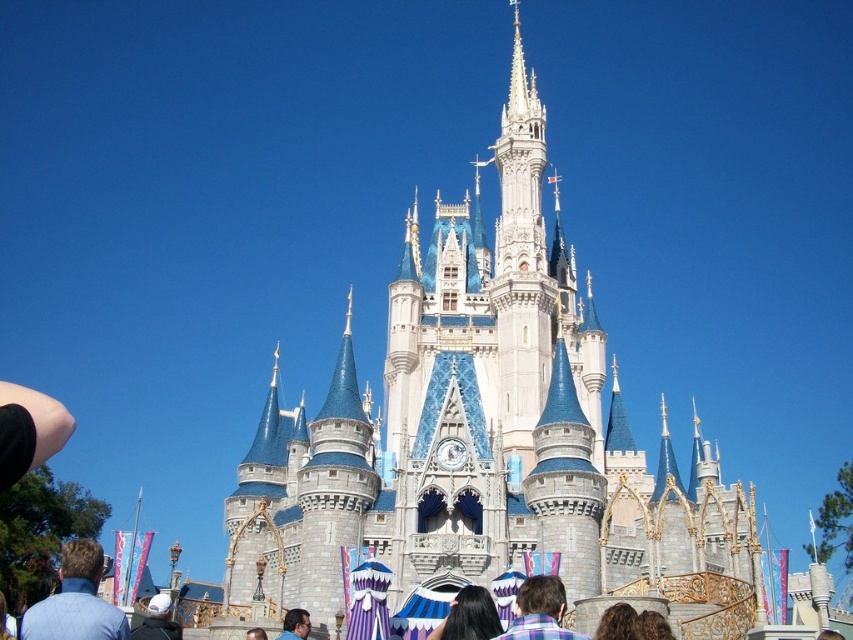
Which of these two, blue shirt at lower left or white matte helmet at lower left, stands taller?

blue shirt at lower left

Can you confirm if blue shirt at lower left is bigger than white matte helmet at lower left?

Yes, blue shirt at lower left is bigger than white matte helmet at lower left.

What do you see at coordinates (74, 600) in the screenshot? I see `blue shirt at lower left` at bounding box center [74, 600].

Identify the location of blue shirt at lower left. (74, 600).

Does white stone castle at center appear on the left side of black hair at center?

Incorrect, white stone castle at center is not on the left side of black hair at center.

Is point (520, 244) positioned after point (496, 609)?

Yes.

Where is `white stone castle at center`? This screenshot has width=853, height=640. white stone castle at center is located at coordinates (483, 442).

Measure the distance between point (463, 605) and camera.

They are 161.36 feet apart.

Between black hair at center and white matte helmet at lower left, which one appears on the left side from the viewer's perspective?

From the viewer's perspective, white matte helmet at lower left appears more on the left side.

The width and height of the screenshot is (853, 640). What do you see at coordinates (469, 616) in the screenshot? I see `black hair at center` at bounding box center [469, 616].

The height and width of the screenshot is (640, 853). I want to click on black hair at center, so click(x=469, y=616).